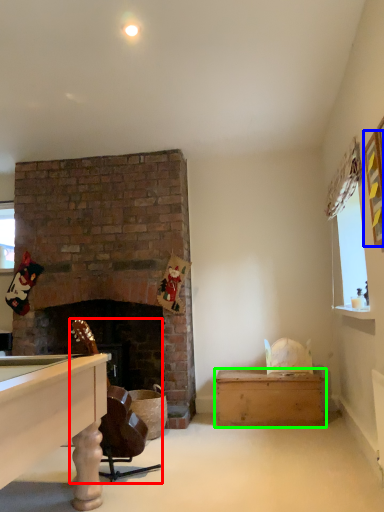
Question: Considering the real-world distances, which object is closest to rocking chair (highlighted by a red box)? picture frame (highlighted by a blue box) or table (highlighted by a green box).

Choices:
 (A) picture frame
 (B) table

Answer: (B)